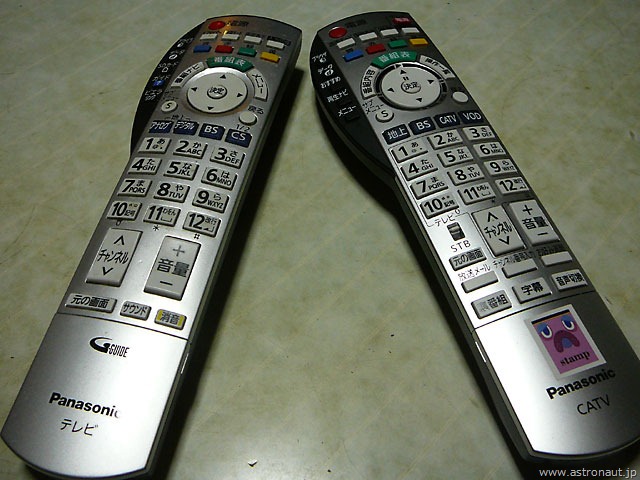
The width and height of the screenshot is (640, 480). I want to click on table, so click(x=346, y=336).